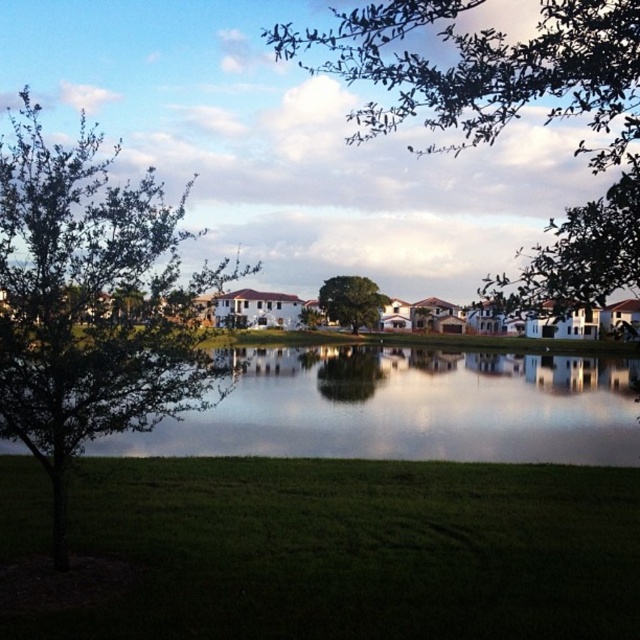
Question: Is clear glass water at center smaller than green leafy tree at center?

Choices:
 (A) yes
 (B) no

Answer: (B)

Question: Which point is closer to the camera?

Choices:
 (A) green leafy tree at left
 (B) green leafy tree at upper center
 (C) green leafy tree at center
 (D) clear glass water at center

Answer: (B)

Question: Does green leafy tree at left appear on the right side of clear glass water at center?

Choices:
 (A) yes
 (B) no

Answer: (B)

Question: Which of the following is the farthest from the observer?

Choices:
 (A) (444, 410)
 (B) (60, 177)

Answer: (A)

Question: Which is nearer to the green leafy tree at left?

Choices:
 (A) clear glass water at center
 (B) green leafy tree at upper center

Answer: (B)

Question: In this image, where is green leafy tree at upper center located relative to green leafy tree at center?

Choices:
 (A) left
 (B) right

Answer: (B)